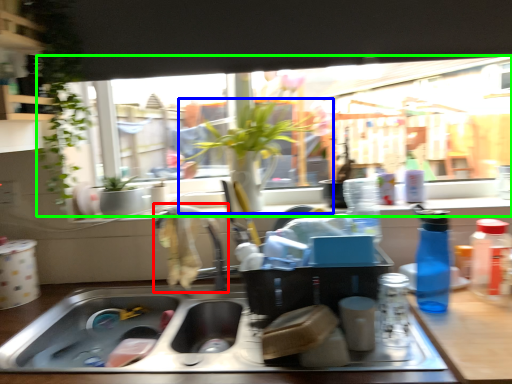
Question: Based on their relative distances, which object is nearer to faucet (highlighted by a red box)? Choose from houseplant (highlighted by a blue box) and window (highlighted by a green box).

Choices:
 (A) houseplant
 (B) window

Answer: (A)